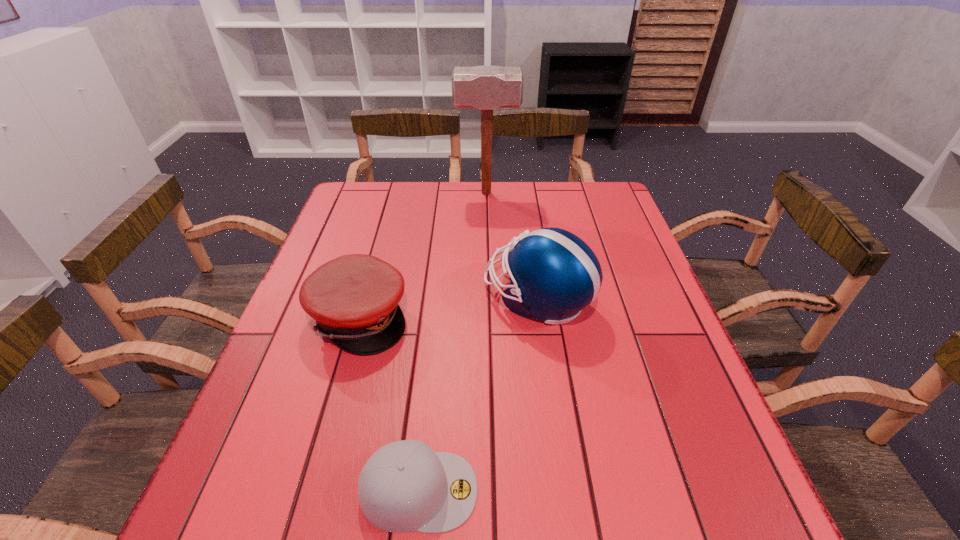
Identify the location of free point located at the front of the football helmet with the faceguard. The width and height of the screenshot is (960, 540). (382, 299).

Find the location of a particular element. Image resolution: width=960 pixels, height=540 pixels. blank space located at the front of the football helmet with the faceguard is located at coordinates (415, 299).

You are a GUI agent. You are given a task and a screenshot of the screen. Output one action in this format:
    pyautogui.click(x=<x>, y=<y>)
    Task: Click on the free space located 0.320m at the front of the football helmet with the faceguard
    The height and width of the screenshot is (540, 960).
    Given the screenshot: What is the action you would take?
    pyautogui.click(x=354, y=299)

Identify the location of free space located 0.230m at the front of the farther cap where the visor is located. (506, 318).

Find the location of `vacant space located 0.130m on the front-facing side of the nearest object`. vacant space located 0.130m on the front-facing side of the nearest object is located at coordinates (555, 490).

Where is `object present at the far edge`? Image resolution: width=960 pixels, height=540 pixels. object present at the far edge is located at coordinates (487, 88).

In order to click on object located in the near edge section of the desktop in this screenshot , I will do `click(405, 486)`.

Find the location of a particular element. This screenshot has width=960, height=540. object at the left edge is located at coordinates (354, 298).

Where is `free space at the far edge`? free space at the far edge is located at coordinates (460, 221).

Where is `free location at the left edge of the desktop`? This screenshot has height=540, width=960. free location at the left edge of the desktop is located at coordinates (295, 424).